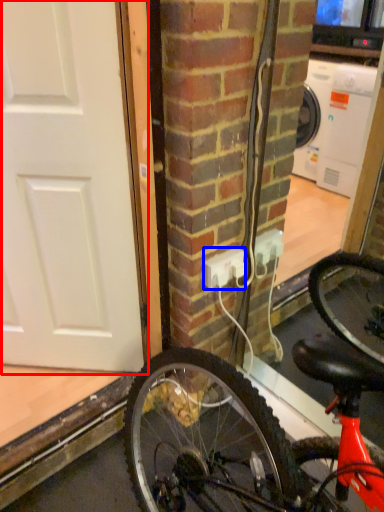
Question: Which point is closer to the camera, door (highlighted by a red box) or power outlet (highlighted by a blue box)?

Choices:
 (A) door
 (B) power outlet

Answer: (A)